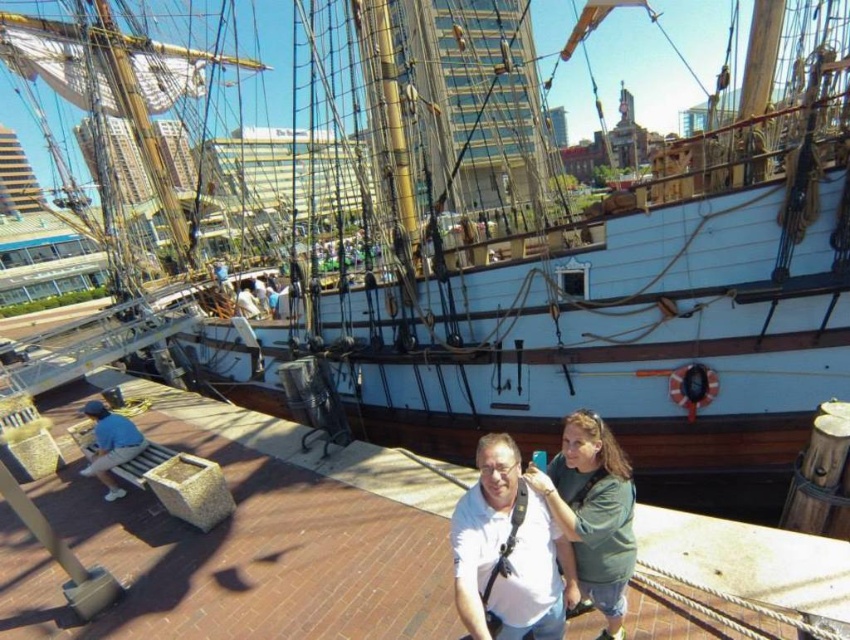
Is point (463, 506) positioned before point (91, 474)?

Yes, it is.

Does point (459, 586) come behind point (102, 412)?

No.

Image resolution: width=850 pixels, height=640 pixels. Find the location of `white matte shirt at center`. white matte shirt at center is located at coordinates (510, 554).

Is green matte shirt at center shorter than blue denim shorts at lower left?

In fact, green matte shirt at center may be taller than blue denim shorts at lower left.

Between point (576, 548) and point (102, 410), which one is positioned behind?

The point (102, 410) is behind.

The width and height of the screenshot is (850, 640). What are the coordinates of `green matte shirt at center` in the screenshot? It's located at tap(592, 513).

What do you see at coordinates (510, 554) in the screenshot?
I see `white matte shirt at center` at bounding box center [510, 554].

Is point (534, 636) positioned before point (554, 461)?

Yes, it is in front of point (554, 461).

Locate an element on the screen. Image resolution: width=850 pixels, height=640 pixels. white matte shirt at center is located at coordinates (510, 554).